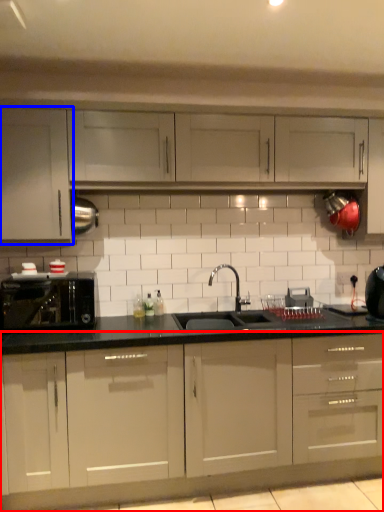
Question: Which object is further to the camera taking this photo, cabinetry (highlighted by a red box) or cabinetry (highlighted by a blue box)?

Choices:
 (A) cabinetry
 (B) cabinetry

Answer: (B)